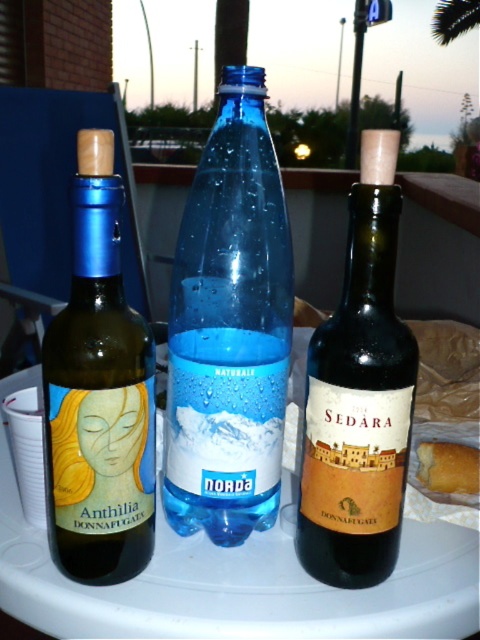
Which bottle is larger, the matte glass wine at left or the dark brown glass wine at center?

The dark brown glass wine at center is larger than the matte glass wine at left.

You are a delivery person who needs to place a small package between the matte glass wine at left and the golden bread at center. Can you fit it there if the package is 10 inches long?

The distance between the matte glass wine at left and the golden bread at center is 10.08 inches. Since the package is 10 inches long, it can fit as there is enough space.